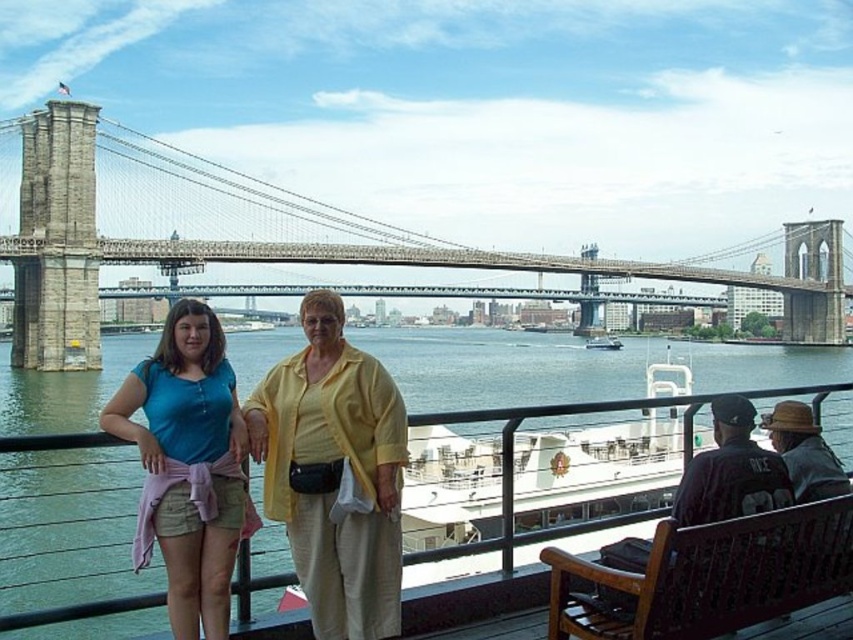
Measure the distance between green water at lower center and white matte boat at center.

The distance of green water at lower center from white matte boat at center is 61.04 meters.

Is green water at lower center taller than white matte boat at center?

Yes.

Between point (714, 353) and point (598, 344), which one is positioned in front?

Point (598, 344) is in front.

You are a GUI agent. You are given a task and a screenshot of the screen. Output one action in this format:
    pyautogui.click(x=<x>, y=<y>)
    Task: Click on the green water at lower center
    Image resolution: width=853 pixels, height=640 pixels.
    Given the screenshot: What is the action you would take?
    pyautogui.click(x=573, y=368)

How much distance is there between matte yellow blouse at center and matte blue shirt at center?

A distance of 10.62 feet exists between matte yellow blouse at center and matte blue shirt at center.

Who is more forward, (329, 340) or (206, 467)?

Point (206, 467) is in front.

The height and width of the screenshot is (640, 853). I want to click on matte yellow blouse at center, so click(268, 468).

Which is more to the right, matte yellow blouse at center or stone suspension bridge at center?

stone suspension bridge at center

Does point (315, 312) come closer to viewer compared to point (282, 260)?

Yes, it is.

Locate an element on the screen. The image size is (853, 640). matte yellow blouse at center is located at coordinates (268, 468).